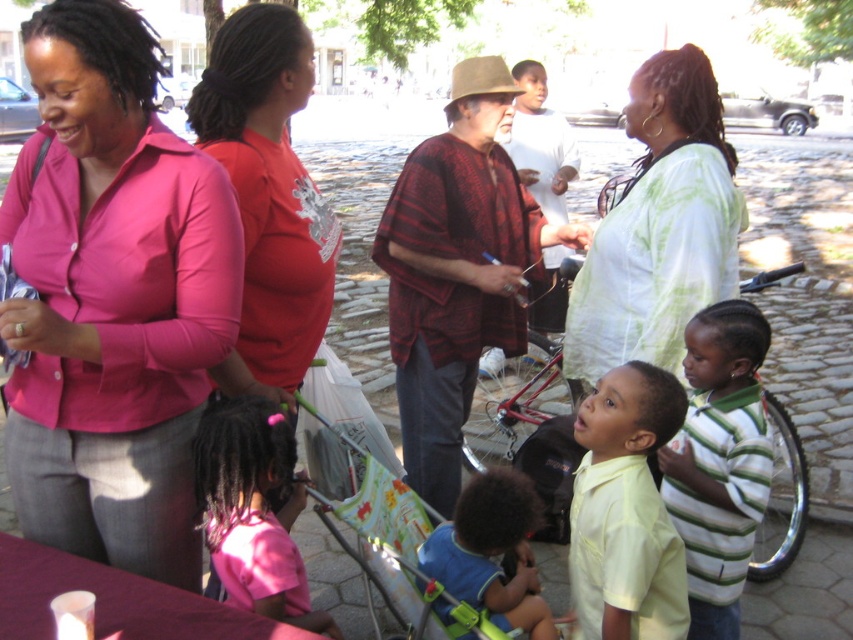
Question: Which of the following is the closest to the observer?

Choices:
 (A) reddish-brown woven poncho at center
 (B) striped cotton shirt at lower right

Answer: (B)

Question: Can you confirm if reddish-brown woven poncho at center is positioned to the left of matte red shirt at center?

Choices:
 (A) yes
 (B) no

Answer: (B)

Question: Is reddish-brown woven poncho at center above light green tie-dye blouse at center?

Choices:
 (A) no
 (B) yes

Answer: (A)

Question: Is pink satin blouse at upper left above striped cotton shirt at lower right?

Choices:
 (A) no
 (B) yes

Answer: (B)

Question: Among these points, which one is farthest from the camera?

Choices:
 (A) (218, 64)
 (B) (467, 497)

Answer: (A)

Question: Which object is positioned closest to the reddish-brown woven poncho at center?

Choices:
 (A) striped cotton shirt at lower right
 (B) matte red shirt at center
 (C) pink fabric shirt at lower left
 (D) pink satin blouse at upper left

Answer: (B)